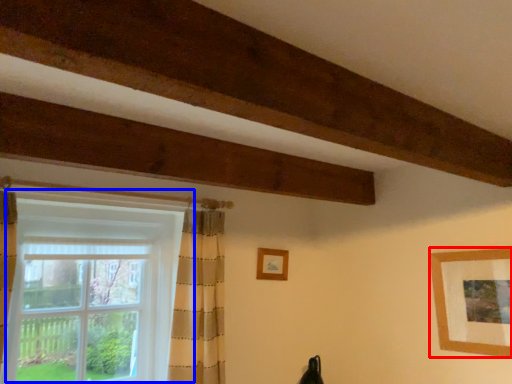
Question: Among these objects, which one is nearest to the camera, picture frame (highlighted by a red box) or window (highlighted by a blue box)?

Choices:
 (A) picture frame
 (B) window

Answer: (B)